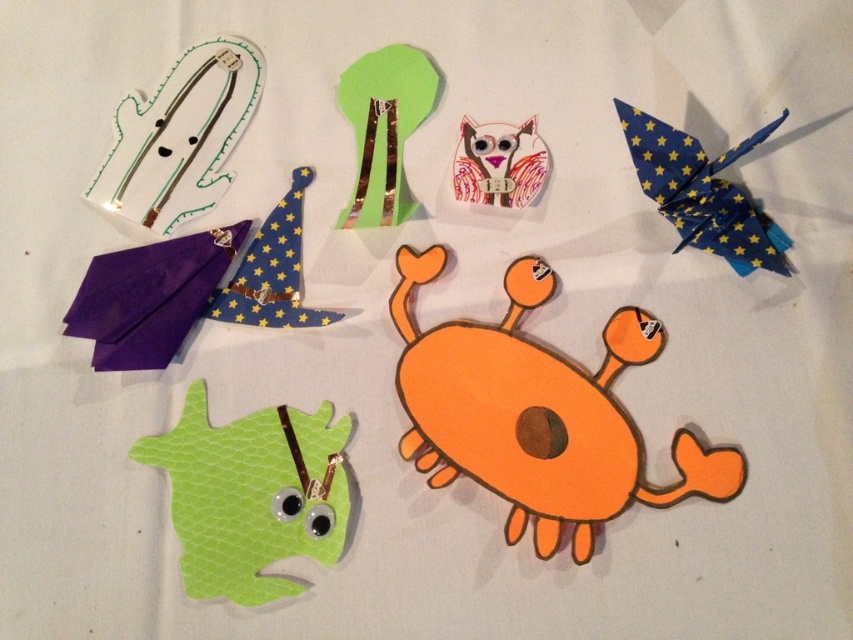
Does green textured monster at lower left have a greater height compared to blue starry fabric wizard hat at upper left?

Yes, green textured monster at lower left is taller than blue starry fabric wizard hat at upper left.

Which is more to the left, green textured monster at lower left or blue starry fabric wizard hat at upper left?

Positioned to the left is green textured monster at lower left.

Locate an element on the screen. The height and width of the screenshot is (640, 853). green textured monster at lower left is located at coordinates (251, 493).

Does white paper ghost at upper left have a lesser width compared to blue star-patterned origami bird at upper right?

In fact, white paper ghost at upper left might be wider than blue star-patterned origami bird at upper right.

Locate an element on the screen. The height and width of the screenshot is (640, 853). white paper ghost at upper left is located at coordinates (180, 136).

Describe the element at coordinates (180, 136) in the screenshot. I see `white paper ghost at upper left` at that location.

Where is `white paper ghost at upper left`? white paper ghost at upper left is located at coordinates (180, 136).

Can you confirm if blue star-patterned origami bird at upper right is smaller than blue starry fabric wizard hat at upper left?

Incorrect, blue star-patterned origami bird at upper right is not smaller in size than blue starry fabric wizard hat at upper left.

Is point (740, 227) farther from camera compared to point (202, 314)?

No, it is in front of (202, 314).

Is point (691, 180) less distant than point (316, 323)?

Yes, it is in front of point (316, 323).

What are the coordinates of `blue star-patterned origami bird at upper right` in the screenshot? It's located at [703, 193].